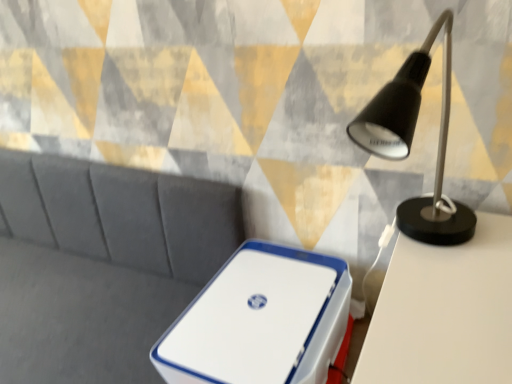
The image size is (512, 384). What do you see at coordinates (411, 142) in the screenshot?
I see `black matte desk lamp at upper right` at bounding box center [411, 142].

At what (x,y) coordinates should I click in order to perform the action: click on black matte desk lamp at upper right. Please return your answer as a coordinate pair (x, y). Looking at the image, I should click on (411, 142).

Measure the distance between point (210, 320) and camera.

Point (210, 320) is 34.29 inches from camera.

Find the location of a particular element. The image size is (512, 384). white plastic storage box at center is located at coordinates (261, 320).

Describe the element at coordinates (261, 320) in the screenshot. This screenshot has width=512, height=384. I see `white plastic storage box at center` at that location.

Identify the location of black matte desk lamp at upper right. This screenshot has width=512, height=384. (411, 142).

Between black matte desk lamp at upper right and white plastic storage box at center, which one appears on the left side from the viewer's perspective?

From the viewer's perspective, white plastic storage box at center appears more on the left side.

Is black matte desk lamp at upper right positioned in front of white plastic storage box at center?

Yes, it is.

Does point (445, 143) come behind point (196, 371)?

Yes, it is behind point (196, 371).

From the image's perspective, who appears lower, black matte desk lamp at upper right or white plastic storage box at center?

white plastic storage box at center is shown below in the image.

From a real-world perspective, between black matte desk lamp at upper right and white plastic storage box at center, who is vertically higher?

black matte desk lamp at upper right.

Looking at this image, which of these two, black matte desk lamp at upper right or white plastic storage box at center, is wider?

black matte desk lamp at upper right is wider.

Can you confirm if black matte desk lamp at upper right is shorter than white plastic storage box at center?

In fact, black matte desk lamp at upper right may be taller than white plastic storage box at center.

Consider the image. Between black matte desk lamp at upper right and white plastic storage box at center, which one has smaller size?

white plastic storage box at center.

Is white plastic storage box at center located within black matte desk lamp at upper right?

Actually, white plastic storage box at center is outside black matte desk lamp at upper right.

Does black matte desk lamp at upper right touch white plastic storage box at center?

No, black matte desk lamp at upper right is not beside white plastic storage box at center.

Does black matte desk lamp at upper right turn towards white plastic storage box at center?

No.

From the picture: Can you tell me how much black matte desk lamp at upper right and white plastic storage box at center differ in facing direction?

They differ by 84.9 degrees in their facing directions.

Image resolution: width=512 pixels, height=384 pixels. In the image, there is a white plastic storage box at center. What are the coordinates of `lamp above it (from the image's perspective)` in the screenshot? It's located at (411, 142).

Looking at this image, which object is positioned more to the right, white plastic storage box at center or black matte desk lamp at upper right?

Positioned to the right is black matte desk lamp at upper right.

Considering the relative positions of white plastic storage box at center and black matte desk lamp at upper right in the image provided, is white plastic storage box at center in front of black matte desk lamp at upper right?

No, it is not.

Which point is more forward, (209, 296) or (390, 104)?

Point (390, 104)

From the image's perspective, is white plastic storage box at center positioned above or below black matte desk lamp at upper right?

Clearly, from the image's perspective, white plastic storage box at center is below black matte desk lamp at upper right.

From a real-world perspective, is white plastic storage box at center above or below black matte desk lamp at upper right?

A: In terms of real-world spatial position, white plastic storage box at center is below black matte desk lamp at upper right.

In terms of width, does white plastic storage box at center look wider or thinner when compared to black matte desk lamp at upper right?

white plastic storage box at center is thinner than black matte desk lamp at upper right.

Considering the relative sizes of white plastic storage box at center and black matte desk lamp at upper right in the image provided, is white plastic storage box at center taller than black matte desk lamp at upper right?

Incorrect, the height of white plastic storage box at center is not larger of that of black matte desk lamp at upper right.

Can you confirm if white plastic storage box at center is bigger than black matte desk lamp at upper right?

No, white plastic storage box at center is not bigger than black matte desk lamp at upper right.

Is white plastic storage box at center spatially inside black matte desk lamp at upper right, or outside of it?

white plastic storage box at center cannot be found inside black matte desk lamp at upper right.

Is white plastic storage box at center beside black matte desk lamp at upper right?

There is a gap between white plastic storage box at center and black matte desk lamp at upper right.

Is white plastic storage box at center looking in the opposite direction of black matte desk lamp at upper right?

No, white plastic storage box at center is not facing away from black matte desk lamp at upper right.

Can you tell me how much white plastic storage box at center and black matte desk lamp at upper right differ in facing direction?

84.9 degrees.

Find the location of `storage box that is under the black matte desk lamp at upper right (from a real-world perspective)`. storage box that is under the black matte desk lamp at upper right (from a real-world perspective) is located at coordinates (261, 320).

You are a GUI agent. You are given a task and a screenshot of the screen. Output one action in this format:
    pyautogui.click(x=<x>, y=<y>)
    Task: Click on the storage box on the left of black matte desk lamp at upper right
    This screenshot has width=512, height=384.
    Given the screenshot: What is the action you would take?
    pyautogui.click(x=261, y=320)

Locate an element on the screen. lamp that appears on the right of white plastic storage box at center is located at coordinates click(x=411, y=142).